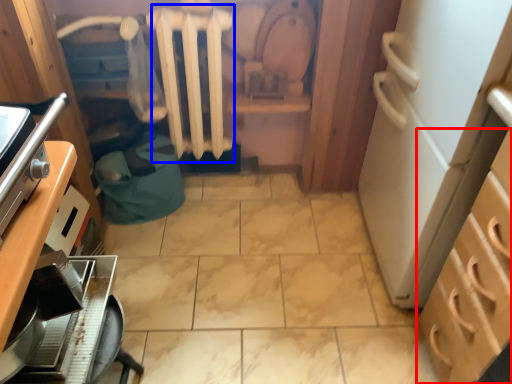
Question: Among these objects, which one is nearest to the camera, cabinetry (highlighted by a red box) or radiator (highlighted by a blue box)?

Choices:
 (A) cabinetry
 (B) radiator

Answer: (A)